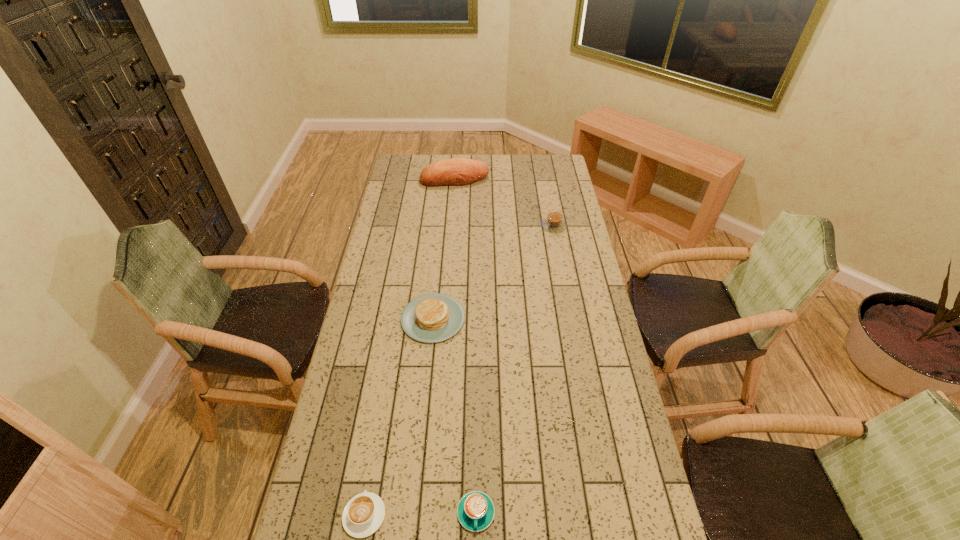
Identify the location of vacant space located on the side of the leftmost cappuccino with the handle. (381, 415).

Where is `free region located 0.050m on the side of the leftmost cappuccino with the handle`? The image size is (960, 540). free region located 0.050m on the side of the leftmost cappuccino with the handle is located at coordinates (372, 475).

Where is `vacant area situated 0.070m on the side of the leftmost cappuccino with the handle`? vacant area situated 0.070m on the side of the leftmost cappuccino with the handle is located at coordinates (372, 468).

Where is `object present at the far edge`? This screenshot has height=540, width=960. object present at the far edge is located at coordinates (458, 171).

I want to click on bread that is at the left edge, so click(x=458, y=171).

What are the coordinates of `cappuccino that is positioned at the left edge` in the screenshot? It's located at (364, 513).

At what (x,y) coordinates should I click in order to perform the action: click on object situated at the right edge. Please return your answer as a coordinate pair (x, y). The height and width of the screenshot is (540, 960). Looking at the image, I should click on (554, 222).

You are a GUI agent. You are given a task and a screenshot of the screen. Output one action in this format:
    pyautogui.click(x=<x>, y=<y>)
    Task: Click on the object at the far left corner
    The height and width of the screenshot is (540, 960).
    Given the screenshot: What is the action you would take?
    [x=458, y=171]

Image resolution: width=960 pixels, height=540 pixels. I want to click on vacant region at the far edge of the desktop, so click(x=505, y=157).

The height and width of the screenshot is (540, 960). In the image, there is a desktop. What are the coordinates of `vacant space at the left edge` in the screenshot? It's located at (365, 336).